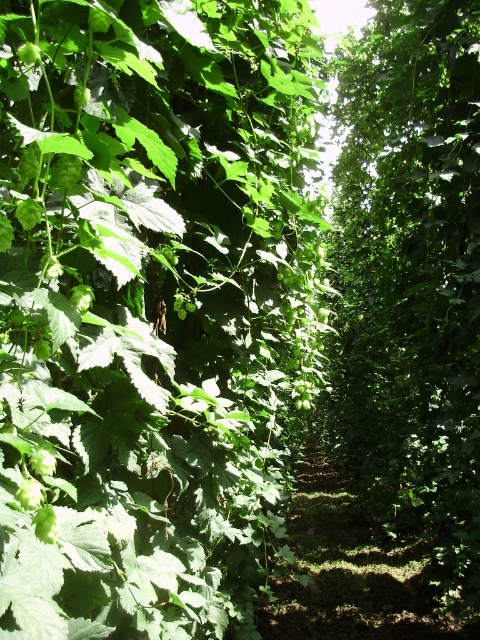
Question: Is green leafy plant at center to the right of green leafy tree at center from the viewer's perspective?

Choices:
 (A) no
 (B) yes

Answer: (A)

Question: Can you confirm if green leafy plant at center is positioned to the left of green leafy tree at center?

Choices:
 (A) no
 (B) yes

Answer: (B)

Question: Is green leafy plant at center to the right of green leafy tree at center from the viewer's perspective?

Choices:
 (A) yes
 (B) no

Answer: (B)

Question: Which of the following is the closest to the observer?

Choices:
 (A) green leafy plant at center
 (B) green leafy tree at center

Answer: (A)